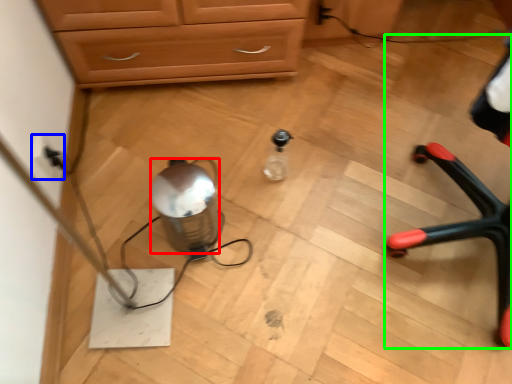
Question: Which is farther away from water (highlighted by a red box)? electric outlet (highlighted by a blue box) or armchair (highlighted by a green box)?

Choices:
 (A) electric outlet
 (B) armchair

Answer: (B)